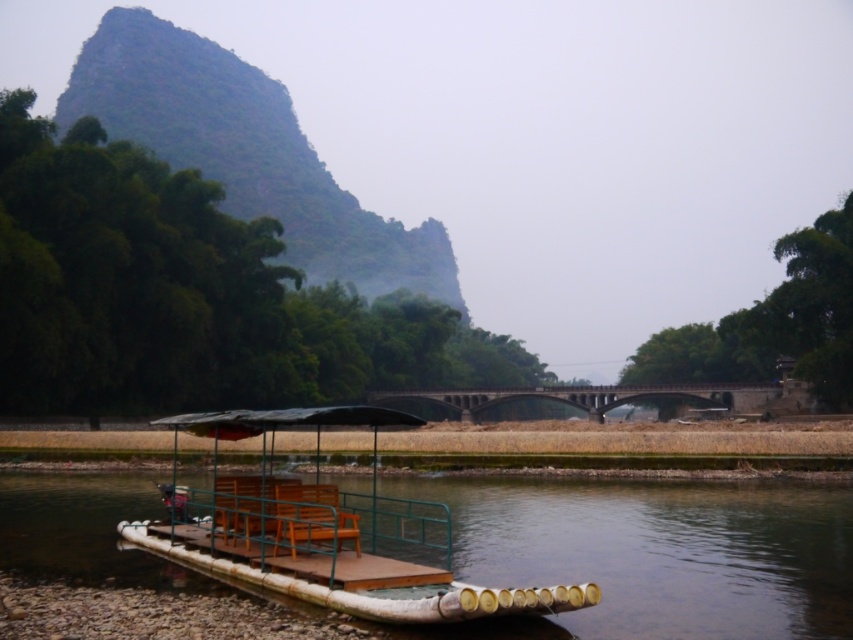
Which of these two, brown wooden raft at lower center or wooden raft at lower center, stands taller?

With more height is wooden raft at lower center.

Image resolution: width=853 pixels, height=640 pixels. What are the coordinates of `brown wooden raft at lower center` in the screenshot? It's located at (654, 556).

Who is more forward, (608,596) or (265,588)?

Point (265,588) is more forward.

The image size is (853, 640). I want to click on brown wooden raft at lower center, so click(654, 556).